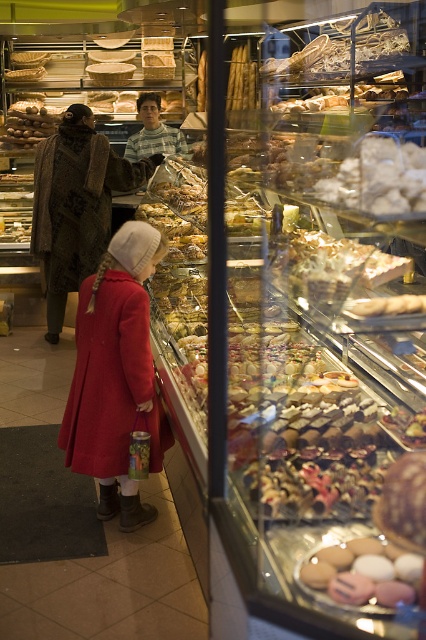
Question: Considering the real-world distances, which object is farthest from the matte red coat at center?

Choices:
 (A) brown textured coat at center
 (B) matte pink macarons at center

Answer: (A)

Question: Is brown textured coat at center further to camera compared to matte pink macarons at center?

Choices:
 (A) no
 (B) yes

Answer: (B)

Question: Does matte red coat at center have a larger size compared to matte pink macarons at center?

Choices:
 (A) no
 (B) yes

Answer: (B)

Question: Which point is closer to the camera taking this photo?

Choices:
 (A) (48, 141)
 (B) (327, 580)
 (C) (123, 294)

Answer: (B)

Question: Can you confirm if brown textured coat at center is positioned below matte pink macarons at center?

Choices:
 (A) no
 (B) yes

Answer: (A)

Question: Estimate the real-world distances between objects in this image. Which object is closer to the matte pink macarons at center?

Choices:
 (A) brown textured coat at center
 (B) matte red coat at center

Answer: (B)